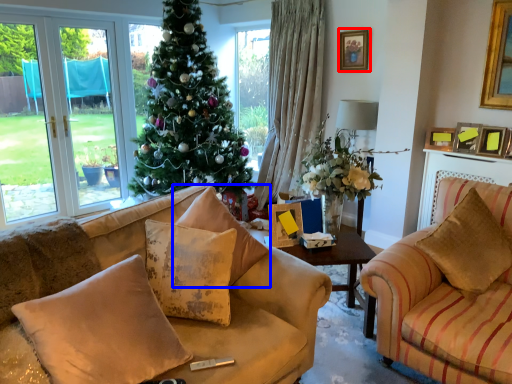
Question: Which object appears closest to the camera in this image, picture frame (highlighted by a red box) or pillow (highlighted by a blue box)?

Choices:
 (A) picture frame
 (B) pillow

Answer: (B)